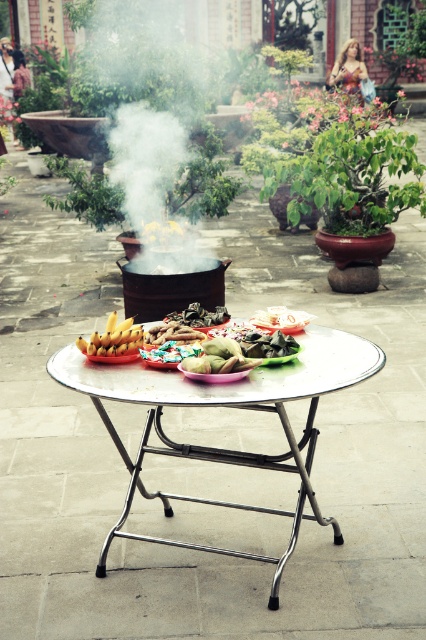
You are setting up a picnic and need to place the green matte vegetable at center and the shiny metallic candy at center on a table. According to the image, which item is positioned to the right of the other?

The green matte vegetable at center is to the right of the shiny metallic candy at center.

You are a visitor in this courtyard and want to know which object is wider between the white smoke at center and the green matte food at center. Can you tell me?

The white smoke at center is wider than the green matte food at center according to the description.